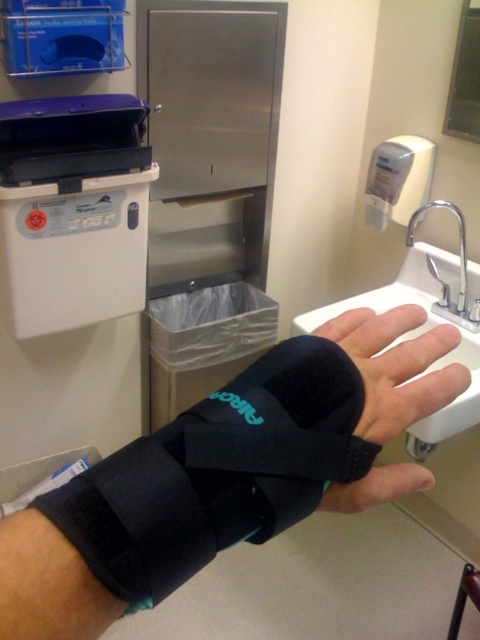
Does black neoprene wrist brace at center have a larger size compared to white ceramic sink at center?

Actually, black neoprene wrist brace at center might be smaller than white ceramic sink at center.

Does black neoprene wrist brace at center appear under white ceramic sink at center?

Indeed, black neoprene wrist brace at center is positioned under white ceramic sink at center.

Measure the distance between black neoprene wrist brace at center and camera.

black neoprene wrist brace at center is 13.62 inches away from camera.

Identify the location of black neoprene wrist brace at center. The width and height of the screenshot is (480, 640). (x=396, y=365).

Between white ceramic sink at center and matte gray plastic hand dryer at upper right, which one is positioned lower?

white ceramic sink at center is lower down.

Is white ceramic sink at center bigger than matte gray plastic hand dryer at upper right?

Yes.

Who is more distant from viewer, (436, 420) or (384, 166)?

The point (384, 166) is more distant.

You are a GUI agent. You are given a task and a screenshot of the screen. Output one action in this format:
    pyautogui.click(x=<x>, y=<y>)
    Task: Click on the white ceramic sink at center
    
    Given the screenshot: What is the action you would take?
    pyautogui.click(x=420, y=333)

Does point (428, 419) come in front of point (464, 296)?

Yes, it is in front of point (464, 296).

Which of these two, white ceramic sink at center or silver metallic faucet at upper right, stands taller?

white ceramic sink at center is taller.

Which is behind, point (474, 332) or point (411, 221)?

Point (411, 221)

Find the location of a particular element. Image resolution: width=480 pixels, height=640 pixels. white ceramic sink at center is located at coordinates (420, 333).